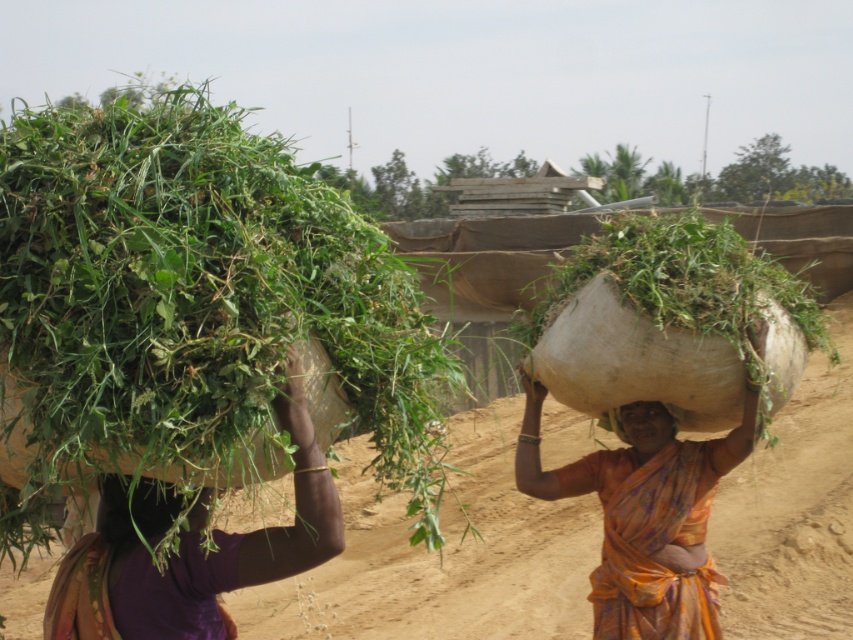
You are a photographer trying to capture the scene of the two individuals carrying loads. You want to ensure that both the green leafy material at upper left and the matte brown head at center are clearly visible in your photo. Based on their positions, which object should you focus on first to ensure depth of field?

The green leafy material at upper left is closer to the viewer than the matte brown head at center. To ensure both are in focus, you should focus on the matte brown head at center first because it is farther away, and depth of field typically extends further behind the point of focus than in front.

You are a photographer trying to capture a wide shot of the scene. You notice the orange floral sari at center and the green leafy material at upper left. Which object would you need to frame more carefully to ensure it fits entirely within the camera view?

The orange floral sari at center might be wider than green leafy material at upper left, so you should frame the orange floral sari at center more carefully to ensure it fits within the camera view since it could be wider.

You are a photographer trying to capture a clear shot of the orange floral sari at center and the green leafy material at upper left. Which object is closer to the camera?

The orange floral sari at center is closer to the camera because the green leafy material at upper left is behind it.